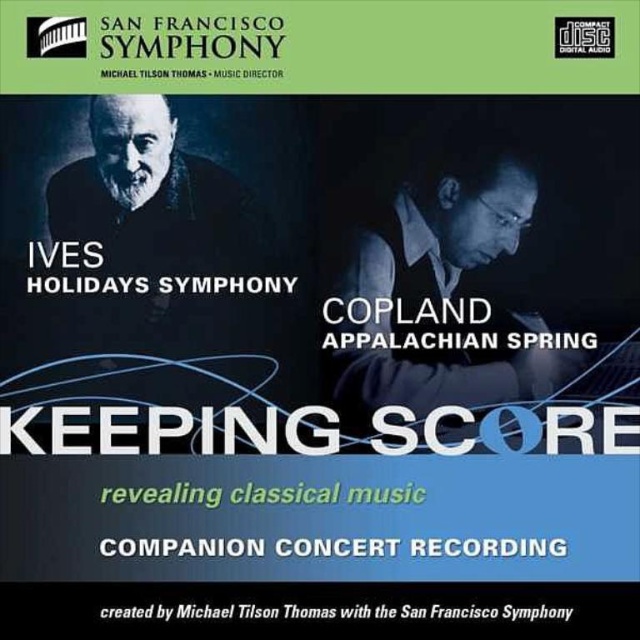
You are designing a layout for a CD cover and want to ensure the text elements are arranged correctly. Given the scene described, which text element is positioned closer to the viewer between the black text at bottom and the green matte text at center?

The black text at bottom is closer to the viewer than the green matte text at center.

You are designing a layout for a CD cover and want to place a new element between the matte black vest at upper right and the white metallic text at center. Based on their positions, which object should the new element be closer to?

The new element should be closer to the white metallic text at center because the matte black vest at upper right is closer to the viewer, meaning there is more space between it and the white metallic text at center.